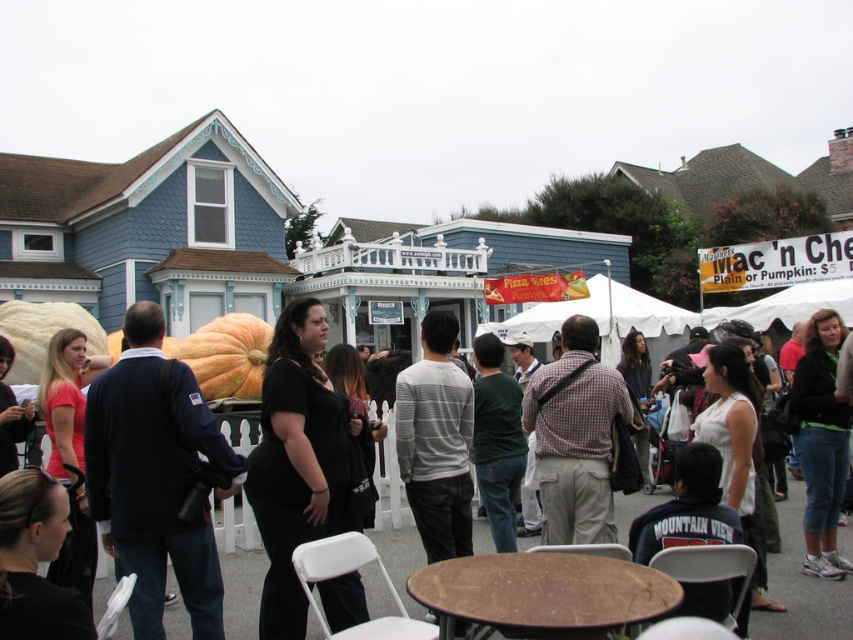
You are standing at the center of the image and see a black dress at center. Which direction should you move to reach the point located at coordinate (801,588)?

The point located at coordinate (801,588) is on the black dress at center, so you are already at the correct location.

You are a photographer at the event and want to capture both the black dress at center and the orange matte pumpkin at center in the same frame. What is the minimum distance you need to move backward to ensure both are visible?

The black dress at center and the orange matte pumpkin at center are 26.99 feet apart. To include both in the frame, the photographer should move back at least 26.99 feet from the closest object to ensure both are visible.